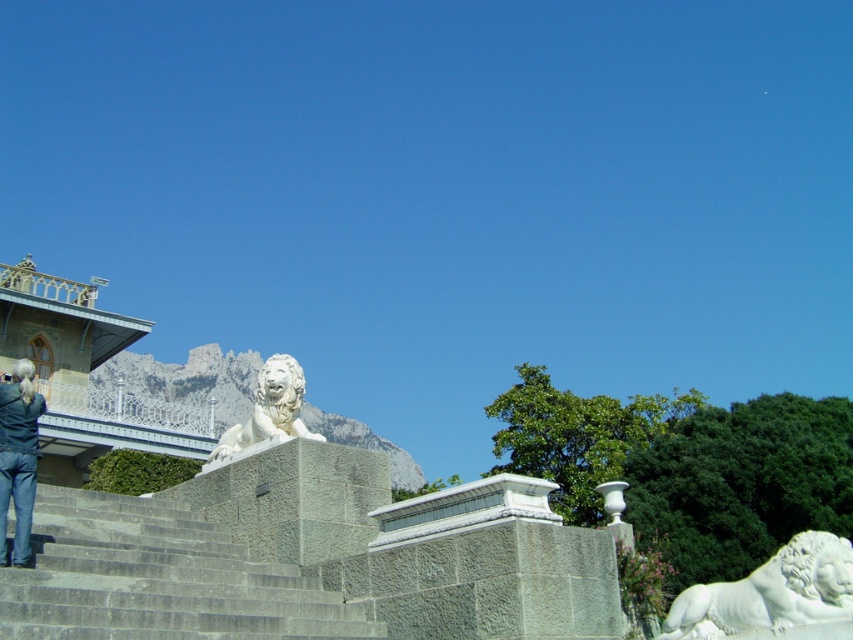
You are standing in front of the stone platform with two white marble lions. If you want to walk from the white marble lion at lower right to the white marble lion at center, which direction should you move?

You should move to the left to reach the white marble lion at center from the white marble lion at lower right since the lion at lower right is on the right side of the center lion.

You are standing at the point with coordinates point [213,448] and want to walk towards the point with coordinates point [802,584]. Which direction should you face to move directly towards your destination?

You should face forward because point [802,584] is in front of point [213,448].